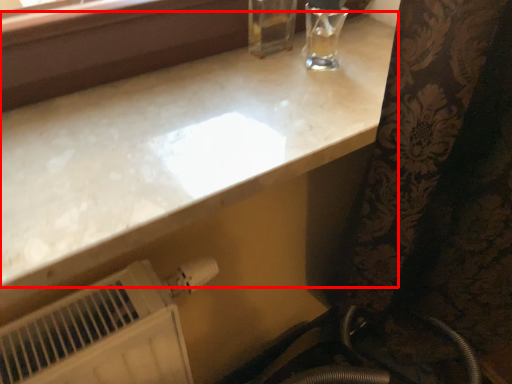
Question: From the image's perspective, what is the correct spatial relationship of countertop (annotated by the red box) in relation to water heater?

Choices:
 (A) above
 (B) below

Answer: (A)